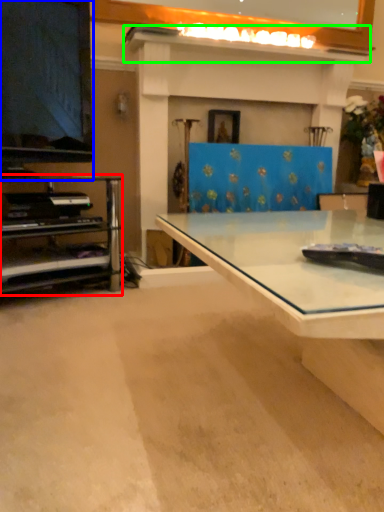
Question: Which object is positioned farthest from shelf (highlighted by a red box)? Select from television (highlighted by a blue box) and mantle (highlighted by a green box).

Choices:
 (A) television
 (B) mantle

Answer: (B)